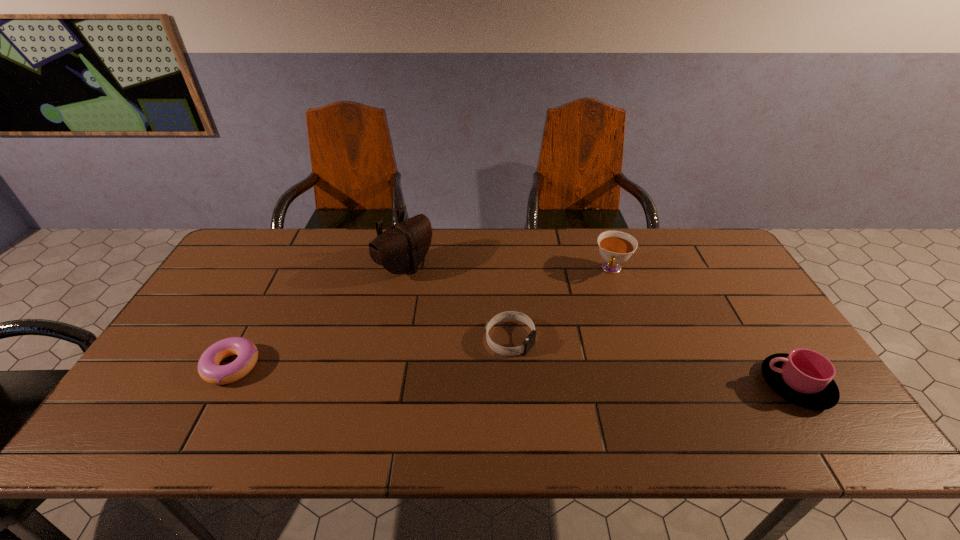
The height and width of the screenshot is (540, 960). I want to click on free space between the fourth shortest object and the second object from left to right, so click(x=509, y=268).

I want to click on vacant region between the wristband and the leftmost object, so click(371, 353).

Find the location of `unoccupied position between the third tallest object and the pouch`. unoccupied position between the third tallest object and the pouch is located at coordinates click(x=600, y=326).

Locate an element on the screen. The image size is (960, 540). object that is the fourth closest to the pouch is located at coordinates (804, 377).

Point out which object is positioned as the fourth nearest to the third object from left to right. Please provide its 2D coordinates. Your answer should be formatted as a tuple, i.e. [(x, y)], where the tuple contains the x and y coordinates of a point satisfying the conditions above.

[(209, 369)]

Where is `vacant position in the image that satisfies the following two spatial constraints: 1. on the front side of the third tallest object; 2. on the side with the handle of the third object from right to left`? This screenshot has height=540, width=960. vacant position in the image that satisfies the following two spatial constraints: 1. on the front side of the third tallest object; 2. on the side with the handle of the third object from right to left is located at coordinates (513, 385).

At what (x,y) coordinates should I click in order to perform the action: click on free space that satisfies the following two spatial constraints: 1. on the front side of the cup; 2. on the side with the handle of the third object from left to right. Please return your answer as a coordinate pair (x, y). The height and width of the screenshot is (540, 960). Looking at the image, I should click on (513, 385).